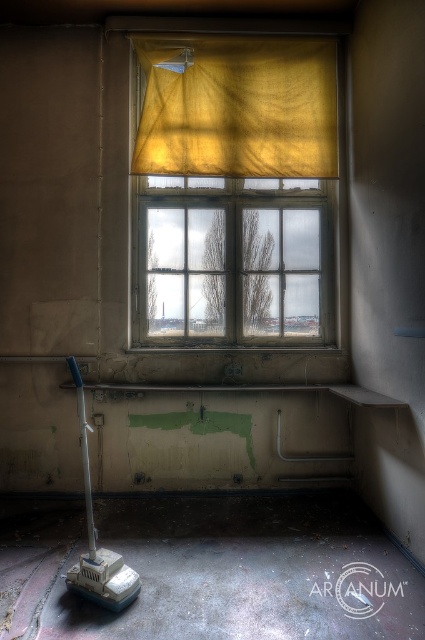
Who is shorter, yellow fabric at center or smooth concrete ledge at lower center?

smooth concrete ledge at lower center is shorter.

In order to click on yellow fabric at center in this screenshot , I will do `click(235, 189)`.

Who is lower down, yellow fabric at center or yellow sheer curtain at upper center?

Positioned lower is yellow fabric at center.

Which is behind, point (294, 189) or point (195, 168)?

Point (294, 189)

The width and height of the screenshot is (425, 640). I want to click on yellow fabric at center, so click(x=235, y=189).

Is yellow sheer curtain at upper center taller than smooth concrete ledge at lower center?

Yes.

Identify the location of yellow sheer curtain at upper center. [238, 108].

Measure the distance between point (189,144) and camera.

Point (189,144) and camera are 3.83 meters apart from each other.

Identify the location of yellow sheer curtain at upper center. The image size is (425, 640). (238, 108).